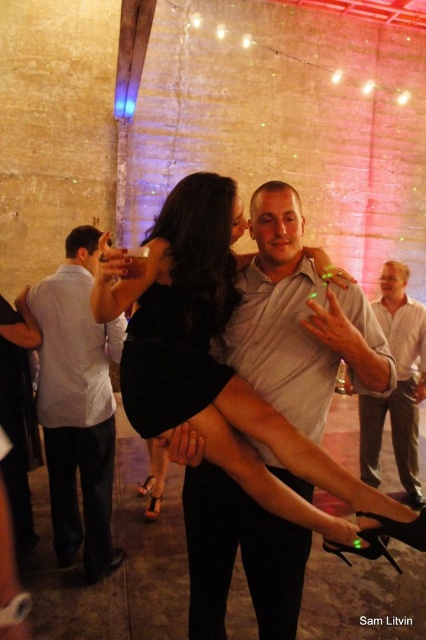
Question: Which object appears farthest from the camera in this image?

Choices:
 (A) white cotton shirt at left
 (B) matte white shirt at center
 (C) white shirt at upper center

Answer: (C)

Question: Does white cotton shirt at left come behind white shirt at upper center?

Choices:
 (A) yes
 (B) no

Answer: (B)

Question: Which point appears farthest from the camera in this image?

Choices:
 (A) (89, 490)
 (B) (259, 557)

Answer: (A)

Question: Is white cotton shirt at left thinner than white shirt at upper center?

Choices:
 (A) yes
 (B) no

Answer: (B)

Question: Which object appears farthest from the camera in this image?

Choices:
 (A) white cotton shirt at left
 (B) matte white shirt at center

Answer: (A)

Question: Can you confirm if white cotton shirt at left is wider than white shirt at upper center?

Choices:
 (A) no
 (B) yes

Answer: (B)